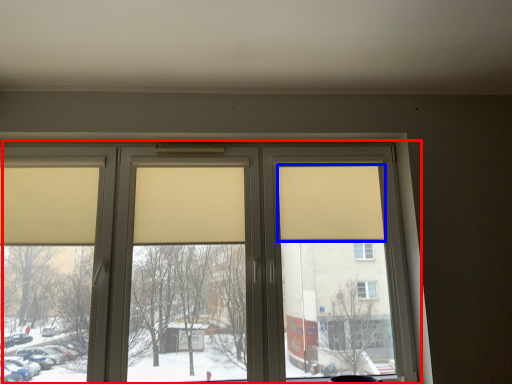
Question: Which object appears farthest to the camera in this image, window (highlighted by a red box) or curtain (highlighted by a blue box)?

Choices:
 (A) window
 (B) curtain

Answer: (B)